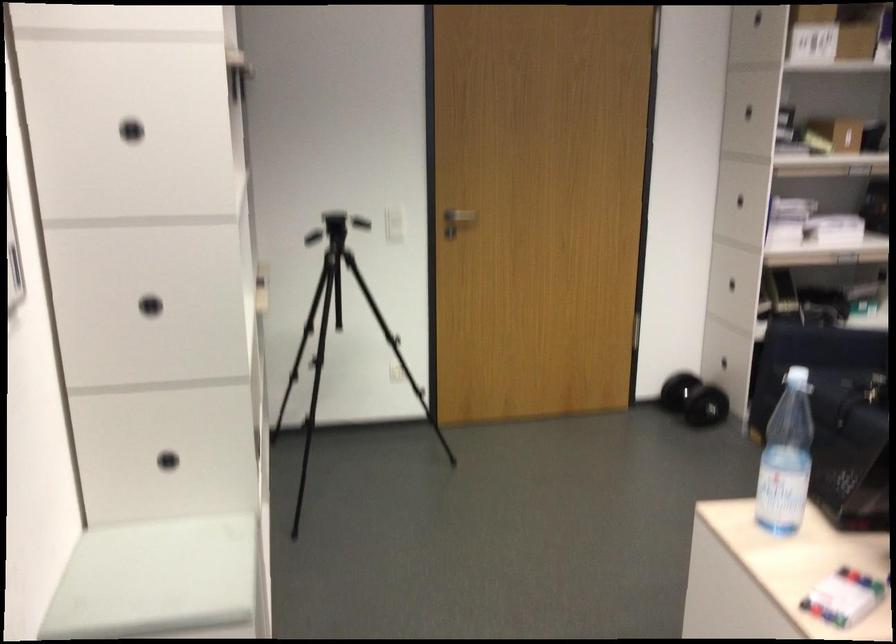
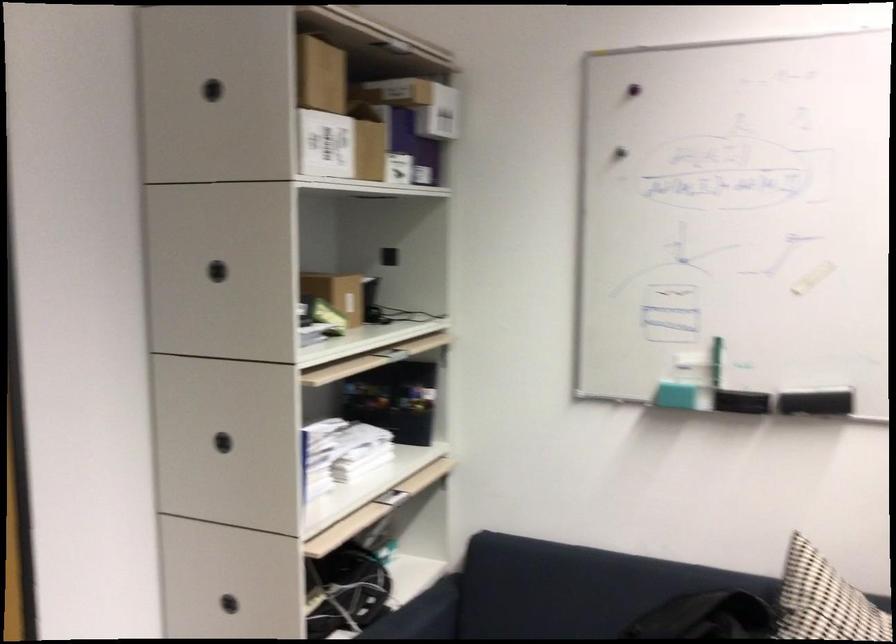
Locate, in the second image, the point that corresponds to [744,113] in the first image.

(217, 270)